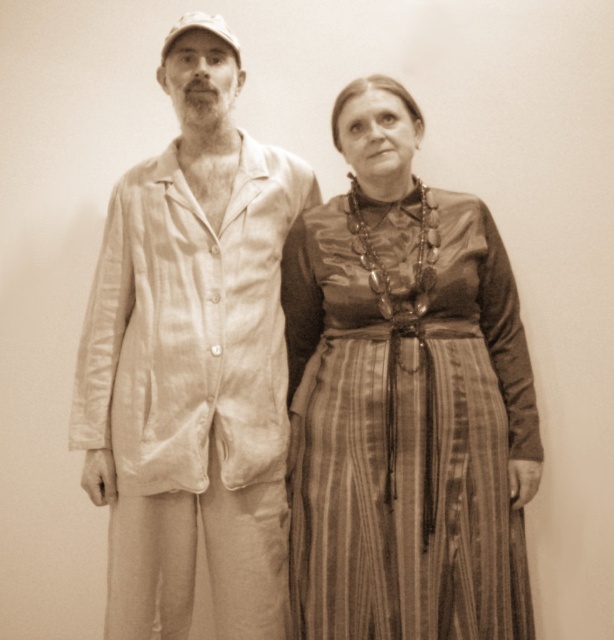
Does striped silk dress at center have a lesser height compared to light beige cotton pajamas at left?

Yes, striped silk dress at center is shorter than light beige cotton pajamas at left.

Which is behind, point (530, 621) or point (187, 214)?

Point (187, 214)

Between point (391, 509) and point (217, 506), which one is positioned behind?

Point (217, 506)

At what (x,y) coordinates should I click in order to perform the action: click on striped silk dress at center. Please return your answer as a coordinate pair (x, y). Looking at the image, I should click on (405, 420).